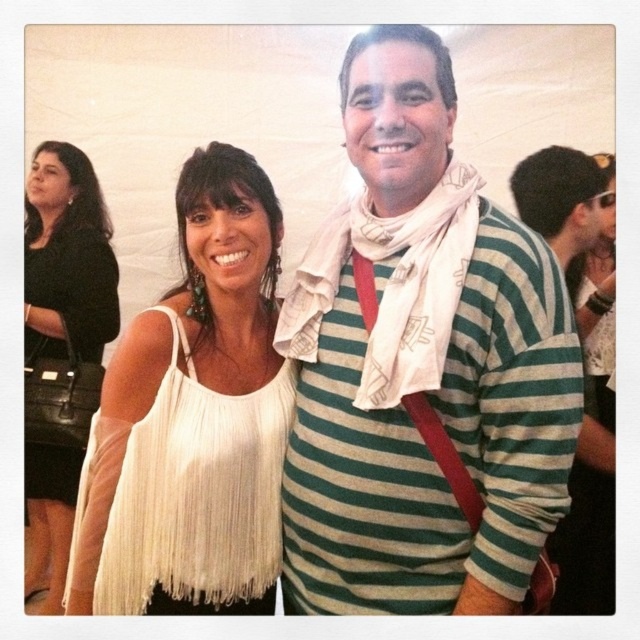
Can you confirm if white fringed tank top at center is thinner than white textured scarf at center?

Incorrect, white fringed tank top at center's width is not less than white textured scarf at center's.

Does white fringed tank top at center come in front of white textured scarf at center?

That is False.

At what (x,y) coordinates should I click in order to perform the action: click on white fringed tank top at center. Please return your answer as a coordinate pair (x, y). Looking at the image, I should click on (196, 492).

Which is more to the left, white fringed tank top at center or black leather purse at left?

black leather purse at left is more to the left.

What do you see at coordinates (196, 492) in the screenshot? I see `white fringed tank top at center` at bounding box center [196, 492].

Where is `white fringed tank top at center`? white fringed tank top at center is located at coordinates (196, 492).

Can you confirm if green striped shirt at center is positioned above white fringed tank top at center?

Yes.

Does point (380, 122) lie behind point (189, 518)?

No, it is not.

I want to click on green striped shirt at center, so click(420, 365).